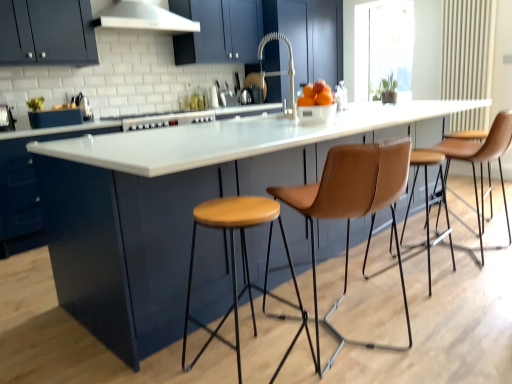
Locate an element on the screen. Image resolution: width=512 pixels, height=384 pixels. orange matte at center is located at coordinates (316, 95).

At what (x,y) coordinates should I click in order to perform the action: click on white glossy table at center. Please return your answer as a coordinate pair (x, y). Looking at the image, I should click on [163, 209].

Measure the distance between point (x=12, y=142) and camera.

Point (x=12, y=142) and camera are 3.02 meters apart from each other.

What do you see at coordinates (25, 193) in the screenshot? This screenshot has width=512, height=384. I see `white glossy countertop at center, the first cabinetry in the bottom-to-top sequence` at bounding box center [25, 193].

Measure the distance between point (x=372, y=47) and camera.

A distance of 4.52 meters exists between point (x=372, y=47) and camera.

Find the location of a particular element. The width and height of the screenshot is (512, 384). orange matte at center is located at coordinates (316, 95).

Which of these two, white glossy countertop at center, the first cabinetry in the bottom-to-top sequence, or white matte faucet at center, stands shorter?

Standing shorter between the two is white matte faucet at center.

Who is more distant, white glossy countertop at center, which appears as the second cabinetry when viewed from the top, or white matte faucet at center?

white glossy countertop at center, which appears as the second cabinetry when viewed from the top.

From a real-world perspective, does white glossy countertop at center, the first cabinetry in the bottom-to-top sequence, sit lower than white matte faucet at center?

Correct, in the physical world, white glossy countertop at center, the first cabinetry in the bottom-to-top sequence, is lower than white matte faucet at center.

In the scene shown: How different are the orientations of white glossy table at center and wooden/matte stool at center in degrees?

white glossy table at center and wooden/matte stool at center are facing 177 degrees away from each other.

From the image's perspective, which one is positioned higher, white glossy table at center or wooden/matte stool at center?

white glossy table at center appears higher in the image.

Is white glossy table at center not close to wooden/matte stool at center?

No, white glossy table at center is in close proximity to wooden/matte stool at center.

Which object is positioned more to the left, white glossy table at center or wooden/matte stool at center?

From the viewer's perspective, wooden/matte stool at center appears more on the left side.

Based on the photo, between tan leather stool at center, the first chair viewed from the left, and transparent glass window at upper right, which one has smaller size?

Smaller between the two is transparent glass window at upper right.

From the image's perspective, would you say tan leather stool at center, positioned as the second chair in right-to-left order, is shown under transparent glass window at upper right?

Indeed, from the image's perspective, tan leather stool at center, positioned as the second chair in right-to-left order, is shown beneath transparent glass window at upper right.

Which object is closer to the camera, tan leather stool at center, placed as the 2th chair when sorted from back to front, or transparent glass window at upper right?

tan leather stool at center, placed as the 2th chair when sorted from back to front, is closer to the camera.

From a real-world perspective, relative to transparent glass window at upper right, is tan leather stool at center, the first chair viewed from the left, vertically above or below?

Clearly, from a real-world perspective, tan leather stool at center, the first chair viewed from the left, is below transparent glass window at upper right.

Is orange matte at center positioned far away from brown leather stool at right, which appears as the second chair when viewed from the front?

Yes, orange matte at center is far from brown leather stool at right, which appears as the second chair when viewed from the front.

Does orange matte at center have a lesser height compared to brown leather stool at right, which appears as the second chair when viewed from the front?

Yes, orange matte at center is shorter than brown leather stool at right, which appears as the second chair when viewed from the front.

Can you confirm if orange matte at center is bigger than brown leather stool at right, which ranks as the second chair in left-to-right order?

No, orange matte at center is not bigger than brown leather stool at right, which ranks as the second chair in left-to-right order.

Does point (310, 94) lie behind point (482, 152)?

That is False.

From a real-world perspective, which is physically above, white glossy table at center or white glossy stove at center?

white glossy stove at center.

What's the angular difference between white glossy table at center and white glossy stove at center's facing directions?

The facing directions of white glossy table at center and white glossy stove at center are 0.74 degrees apart.

Is white glossy table at center facing away from white glossy stove at center?

Yes, white glossy table at center is positioned with its back facing white glossy stove at center.

Which is more to the right, white glossy table at center or white glossy stove at center?

white glossy table at center.

Considering the positions of point (293, 81) and point (360, 62), is point (293, 81) closer or farther from the camera than point (360, 62)?

Point (293, 81) is positioned closer to the camera compared to point (360, 62).

Considering the sizes of objects white matte faucet at center and transparent glass window at upper right in the image provided, who is shorter, white matte faucet at center or transparent glass window at upper right?

With less height is white matte faucet at center.

Considering the sizes of objects white matte faucet at center and transparent glass window at upper right in the image provided, who is wider, white matte faucet at center or transparent glass window at upper right?

With larger width is white matte faucet at center.

From the image's perspective, who appears lower, white matte faucet at center or transparent glass window at upper right?

From the image's view, white matte faucet at center is below.

Considering the points (224, 272) and (315, 82), which point is behind, point (224, 272) or point (315, 82)?

The point (315, 82) is more distant.

Is white glossy table at center to the left of orange matte at center from the viewer's perspective?

In fact, white glossy table at center is to the right of orange matte at center.

From the image's perspective, is white glossy table at center over orange matte at center?

Actually, white glossy table at center appears below orange matte at center in the image.

At what (x,y) coordinates should I click in order to perform the action: click on cabinetry below the white matte faucet at center (from the image's perspective). Please return your answer as a coordinate pair (x, y). The image size is (512, 384). Looking at the image, I should click on (25, 193).

The height and width of the screenshot is (384, 512). Identify the location of stool that is in front of the white glossy table at center. (242, 264).

Estimate the real-world distances between objects in this image. Which object is further from tan leather stool at center, the 1th chair in the front-to-back sequence, transparent glass window at upper right or wooden/matte stool at center?

transparent glass window at upper right is further to tan leather stool at center, the 1th chair in the front-to-back sequence.

Considering their positions, is wooden/matte stool at center positioned further to white glossy stove at center than white matte faucet at center?

Based on the image, wooden/matte stool at center appears to be further to white glossy stove at center.

Which object lies nearer to the anchor point white glossy table at center, matte dark blue cabinet at upper left, which is the 2th cabinetry from bottom to top, or polished stainless steel kettle at upper left, which is counted as the 1th appliance, starting from the back?

Based on the image, matte dark blue cabinet at upper left, which is the 2th cabinetry from bottom to top, appears to be nearer to white glossy table at center.

From the image, which object appears to be nearer to transparent glass window at upper right, brushed metal toaster at left, positioned as the first appliance in left-to-right order, or white glossy countertop at center, the first cabinetry in the bottom-to-top sequence?

The object closer to transparent glass window at upper right is white glossy countertop at center, the first cabinetry in the bottom-to-top sequence.

Estimate the real-world distances between objects in this image. Which object is further from matte dark blue cabinet at upper left, which is the 1th cabinetry in top-to-bottom order, white matte faucet at center or tan leather stool at center, placed as the 2th chair when sorted from back to front?

tan leather stool at center, placed as the 2th chair when sorted from back to front, is positioned further to the anchor matte dark blue cabinet at upper left, which is the 1th cabinetry in top-to-bottom order.

Estimate the real-world distances between objects in this image. Which object is further from tan leather stool at center, placed as the 2th chair when sorted from back to front, brushed metal toaster at left, which is the first appliance in front-to-back order, or matte dark blue cabinet at upper left, which is the 2th cabinetry from bottom to top?

Among the two, matte dark blue cabinet at upper left, which is the 2th cabinetry from bottom to top, is located further to tan leather stool at center, placed as the 2th chair when sorted from back to front.

From the picture: Considering their positions, is matte dark blue cabinet at upper left, which is the 2th cabinetry from bottom to top, positioned further to tan leather stool at center, the first chair viewed from the left, than polished stainless steel kettle at upper left, which is counted as the 1th appliance, starting from the back?

Among the two, matte dark blue cabinet at upper left, which is the 2th cabinetry from bottom to top, is located further to tan leather stool at center, the first chair viewed from the left.

From the image, which object appears to be nearer to white glossy table at center, white matte exhaust hood at upper center or white matte faucet at center?

white matte faucet at center lies closer to white glossy table at center than the other object.

Image resolution: width=512 pixels, height=384 pixels. What are the coordinates of `stove situated between white glossy countertop at center, the first cabinetry in the bottom-to-top sequence, and transparent glass window at upper right from left to right` in the screenshot? It's located at (166, 120).

Locate an element on the screen. This screenshot has width=512, height=384. appliance between matte dark blue cabinet at upper left, which is the 1th cabinetry in top-to-bottom order, and brown leather stool at right, which ranks as the second chair in left-to-right order, from left to right is located at coordinates (84, 106).

The image size is (512, 384). I want to click on faucet between brushed metal toaster at left, which appears as the 2th appliance when viewed from the back, and white glossy table at center, in the horizontal direction, so click(x=279, y=71).

Locate an element on the screen. This screenshot has height=384, width=512. exhaust hood situated between matte dark blue cabinet at upper left, which is the 1th cabinetry in top-to-bottom order, and white matte faucet at center from left to right is located at coordinates pyautogui.click(x=142, y=17).